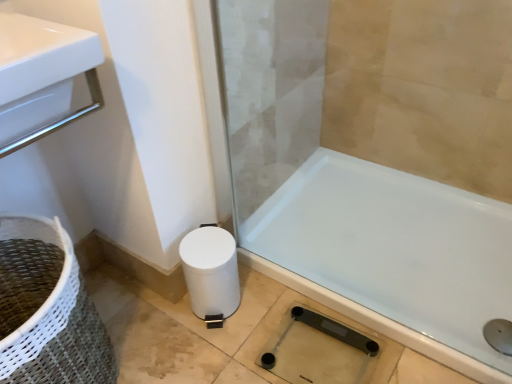
Question: From the image's perspective, is white glossy bathtub at lower right located above transparent glass shower at lower right?

Choices:
 (A) yes
 (B) no

Answer: (A)

Question: From the image's perspective, is white glossy bathtub at lower right below transparent glass shower at lower right?

Choices:
 (A) no
 (B) yes

Answer: (A)

Question: Can you confirm if white glossy bathtub at lower right is wider than transparent glass shower at lower right?

Choices:
 (A) no
 (B) yes

Answer: (B)

Question: Can you confirm if white glossy bathtub at lower right is positioned to the right of transparent glass shower at lower right?

Choices:
 (A) no
 (B) yes

Answer: (B)

Question: Can you confirm if white glossy bathtub at lower right is shorter than transparent glass shower at lower right?

Choices:
 (A) yes
 (B) no

Answer: (B)

Question: From their relative heights in the image, would you say transparent glass shower at lower right is taller or shorter than white glossy bathtub at lower right?

Choices:
 (A) short
 (B) tall

Answer: (A)

Question: Considering the positions of transparent glass shower at lower right and white glossy bathtub at lower right in the image, is transparent glass shower at lower right wider or thinner than white glossy bathtub at lower right?

Choices:
 (A) wide
 (B) thin

Answer: (B)

Question: In the image, is transparent glass shower at lower right positioned in front of or behind white glossy bathtub at lower right?

Choices:
 (A) front
 (B) behind

Answer: (B)

Question: Looking at the image, does transparent glass shower at lower right seem bigger or smaller compared to white glossy bathtub at lower right?

Choices:
 (A) small
 (B) big

Answer: (A)

Question: Looking at the image, does transparent glass shower at lower right seem bigger or smaller compared to white woven basket at lower left?

Choices:
 (A) small
 (B) big

Answer: (A)

Question: In terms of height, does transparent glass shower at lower right look taller or shorter compared to white woven basket at lower left?

Choices:
 (A) tall
 (B) short

Answer: (B)

Question: From the image's perspective, is transparent glass shower at lower right above or below white woven basket at lower left?

Choices:
 (A) above
 (B) below

Answer: (B)

Question: From a real-world perspective, relative to white woven basket at lower left, is transparent glass shower at lower right vertically above or below?

Choices:
 (A) below
 (B) above

Answer: (A)

Question: Is point (242, 79) positioned closer to the camera than point (237, 289)?

Choices:
 (A) farther
 (B) closer

Answer: (B)

Question: Which is correct: transparent glass screen door at lower center is inside white matte toilet paper at lower left, or outside of it?

Choices:
 (A) outside
 (B) inside

Answer: (A)